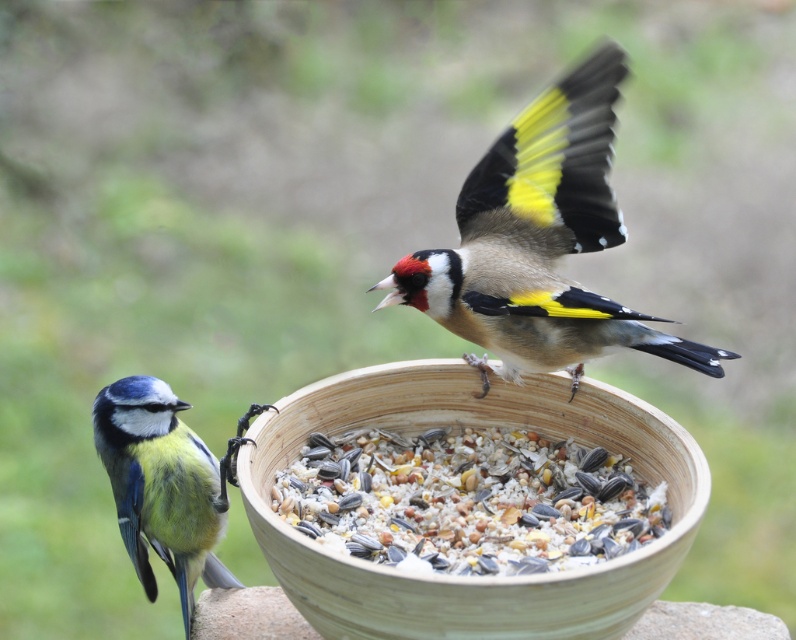
You are a bird watching enthusiast who wants to observe the Blue Tit near the wooden bowl at center and the multicolored seeds at center. From your current position, which object is closer to you?

The wooden bowl at center is closer to you because it is in front of the multicolored seeds at center.

You are standing in front of the bird feeder scene. You want to place a small decoration exactly at the point labeled as point (463, 579). Which object in the scene is located at that point?

The point (463, 579) corresponds to the wooden bowl at center.